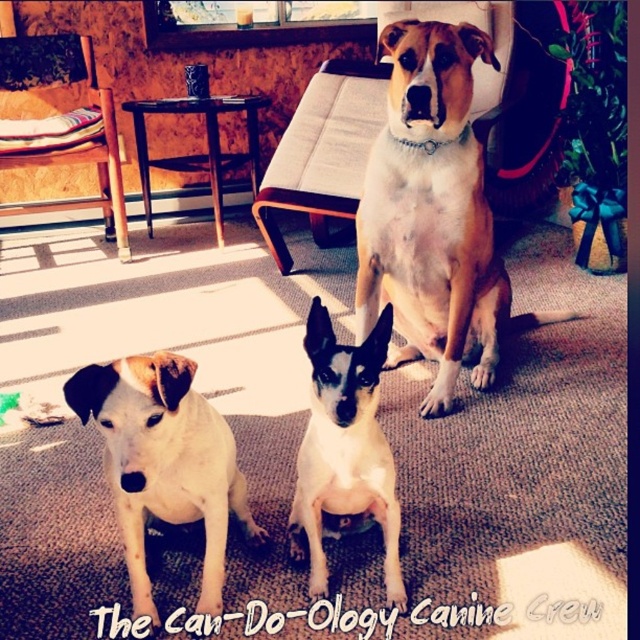
Question: Observing the image, what is the correct spatial positioning of light brown fur at center in reference to brushed wood chair at left?

Choices:
 (A) below
 (B) above

Answer: (A)

Question: Is white smooth dog at center smaller than brushed wood chair at left?

Choices:
 (A) yes
 (B) no

Answer: (A)

Question: Which point is farther to the camera?

Choices:
 (A) light brown fur at center
 (B) white fur dog at lower left

Answer: (A)

Question: Which of the following is the farthest from the observer?

Choices:
 (A) white fur dog at lower left
 (B) white smooth dog at center
 (C) light brown fur at center

Answer: (C)

Question: Does white fur dog at lower left have a smaller size compared to white smooth dog at center?

Choices:
 (A) yes
 (B) no

Answer: (B)

Question: Which of the following is the closest to the observer?

Choices:
 (A) (444, 172)
 (B) (317, 333)

Answer: (B)